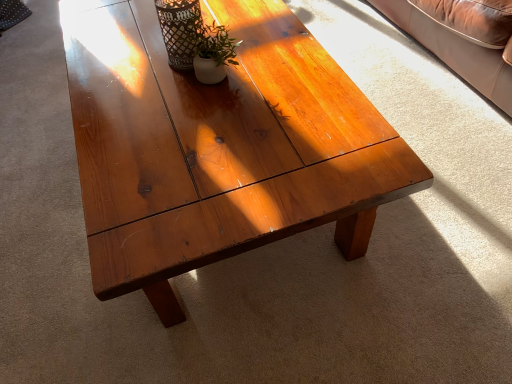
Question: Is matte white vase at center facing towards matte black vase at upper center?

Choices:
 (A) no
 (B) yes

Answer: (A)

Question: From a real-world perspective, is matte white vase at center on matte black vase at upper center?

Choices:
 (A) no
 (B) yes

Answer: (A)

Question: Is matte white vase at center facing away from matte black vase at upper center?

Choices:
 (A) yes
 (B) no

Answer: (B)

Question: Is the depth of matte white vase at center less than that of matte black vase at upper center?

Choices:
 (A) no
 (B) yes

Answer: (B)

Question: Does matte white vase at center have a smaller size compared to matte black vase at upper center?

Choices:
 (A) yes
 (B) no

Answer: (A)

Question: Can you confirm if matte white vase at center is thinner than matte black vase at upper center?

Choices:
 (A) yes
 (B) no

Answer: (A)

Question: Can you confirm if matte black vase at upper center is positioned to the right of satin wood coffee table at center?

Choices:
 (A) yes
 (B) no

Answer: (B)

Question: Considering the relative sizes of matte black vase at upper center and satin wood coffee table at center in the image provided, is matte black vase at upper center smaller than satin wood coffee table at center?

Choices:
 (A) yes
 (B) no

Answer: (A)

Question: Is matte black vase at upper center positioned with its back to satin wood coffee table at center?

Choices:
 (A) yes
 (B) no

Answer: (B)

Question: From a real-world perspective, is matte black vase at upper center on satin wood coffee table at center?

Choices:
 (A) yes
 (B) no

Answer: (A)

Question: From a real-world perspective, is matte black vase at upper center below satin wood coffee table at center?

Choices:
 (A) yes
 (B) no

Answer: (B)

Question: Does matte black vase at upper center have a larger size compared to satin wood coffee table at center?

Choices:
 (A) no
 (B) yes

Answer: (A)

Question: Can you confirm if matte black vase at upper center is shorter than matte white vase at center?

Choices:
 (A) no
 (B) yes

Answer: (A)